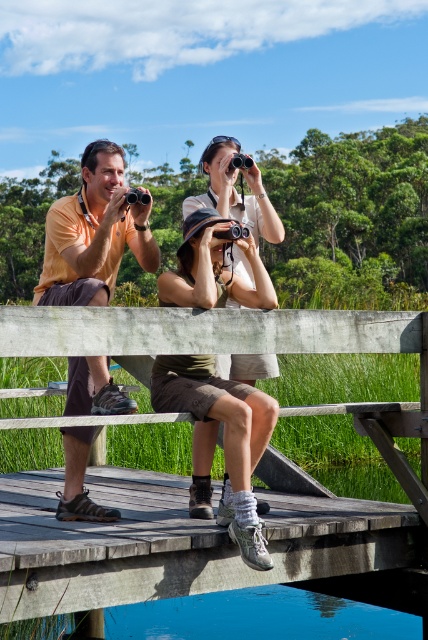
You are a photographer trying to capture a closeup of the khaki cotton shorts at center and the matte black camera at center. Since you want both items to appear in focus, which one should you focus on first to ensure proper depth of field?

The khaki cotton shorts at center is taller than the matte black camera at center, so you should focus on the khaki cotton shorts at center first to ensure both are in focus.

You are standing on the wooden bridge and want to place a small item between the matte yellow shirt at left and the black plastic camera at upper center. Based on their widths, can you determine if there will be enough space between them?

The matte yellow shirt at left might be wider than black plastic camera at upper center, so there may not be enough space between them for the small item.